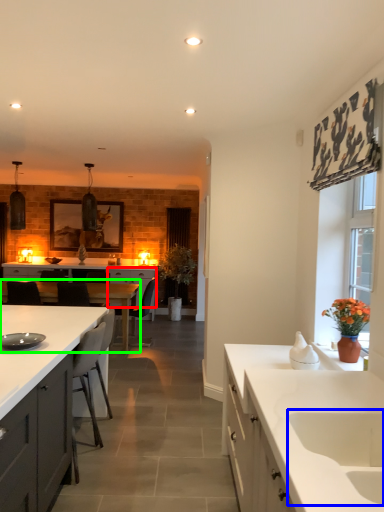
Question: Which is farther away from cabinetry (highlighted by a red box)? sink (highlighted by a blue box) or table (highlighted by a green box)?

Choices:
 (A) sink
 (B) table

Answer: (A)